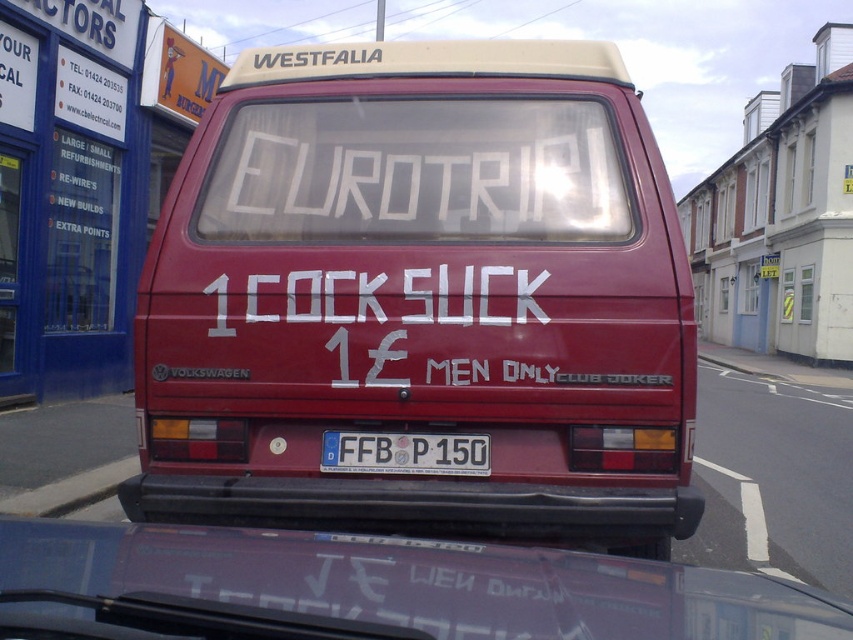
Question: Which object is farther from the camera taking this photo?

Choices:
 (A) metallic purple car at lower center
 (B) white plastic license plate at center
 (C) maroon matte van at center
 (D) transparent glass windshield at center

Answer: (D)

Question: Does maroon matte van at center have a larger size compared to white plastic license plate at center?

Choices:
 (A) yes
 (B) no

Answer: (A)

Question: Is metallic purple car at lower center behind white plastic license plate at center?

Choices:
 (A) yes
 (B) no

Answer: (B)

Question: Which point is farther to the camera?

Choices:
 (A) (428, 474)
 (B) (335, 112)

Answer: (B)

Question: Which of the following is the farthest from the observer?

Choices:
 (A) (346, 64)
 (B) (337, 468)
 (C) (45, 570)
 (D) (344, 150)

Answer: (A)

Question: Is maroon matte van at center to the right of white plastic license plate at center from the viewer's perspective?

Choices:
 (A) no
 (B) yes

Answer: (B)